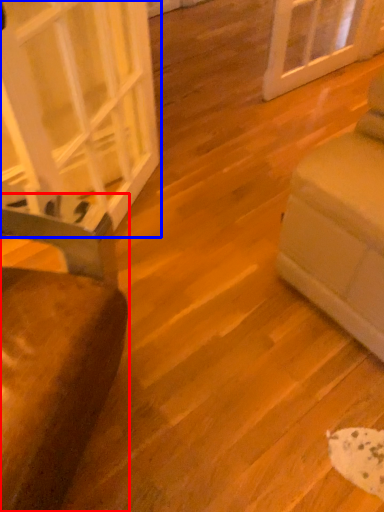
Question: Which object appears closest to the camera in this image, furniture (highlighted by a red box) or glass door (highlighted by a blue box)?

Choices:
 (A) furniture
 (B) glass door

Answer: (A)